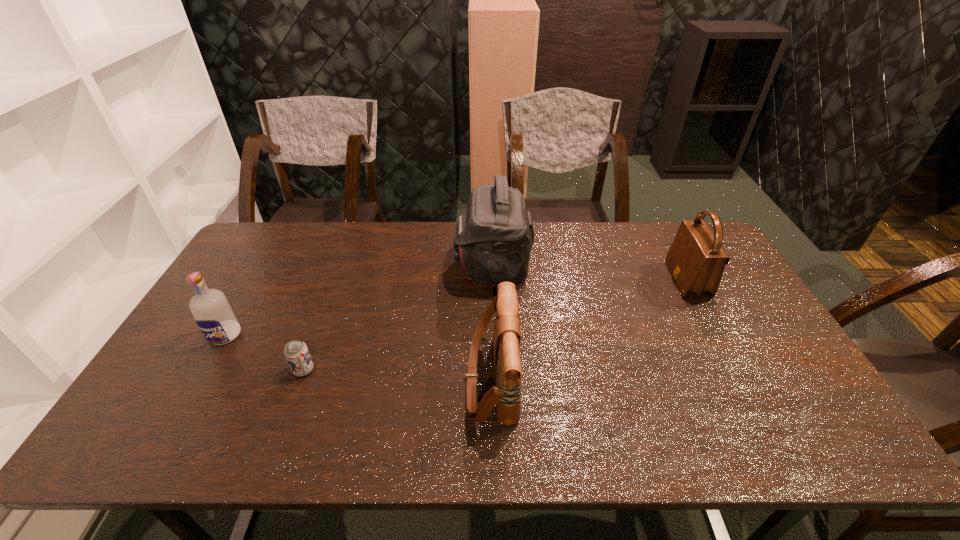
The height and width of the screenshot is (540, 960). What are the coordinates of `object located in the far right corner section of the desktop` in the screenshot? It's located at (696, 260).

In the image, there is a desktop. Identify the location of free region at the far edge. [545, 242].

At what (x,y) coordinates should I click in order to perform the action: click on blank space at the near edge of the desktop. Please return your answer as a coordinate pair (x, y). This screenshot has width=960, height=540. Looking at the image, I should click on (366, 429).

Identify the location of vacant region at the left edge of the desktop. The height and width of the screenshot is (540, 960). (194, 366).

Locate an element on the screen. This screenshot has width=960, height=540. vacant space at the right edge of the desktop is located at coordinates (729, 337).

Image resolution: width=960 pixels, height=540 pixels. In the image, there is a desktop. What are the coordinates of `vacant space at the far left corner` in the screenshot? It's located at (261, 239).

The width and height of the screenshot is (960, 540). I want to click on vacant space at the far right corner, so click(x=660, y=225).

Where is `unoccupied area between the leftmost object and the nearest shoulder bag`? Image resolution: width=960 pixels, height=540 pixels. unoccupied area between the leftmost object and the nearest shoulder bag is located at coordinates (358, 357).

The image size is (960, 540). What are the coordinates of `vacant region between the tallest shoulder bag and the shortest object` in the screenshot? It's located at (397, 319).

Identify the location of free point between the beer can and the vodka. This screenshot has width=960, height=540. (264, 353).